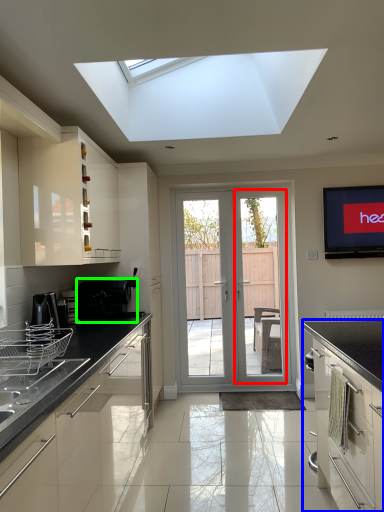
Question: Considering the real-world distances, which object is farthest from screen door (highlighted by a red box)? cabinetry (highlighted by a blue box) or appliance (highlighted by a green box)?

Choices:
 (A) cabinetry
 (B) appliance

Answer: (A)